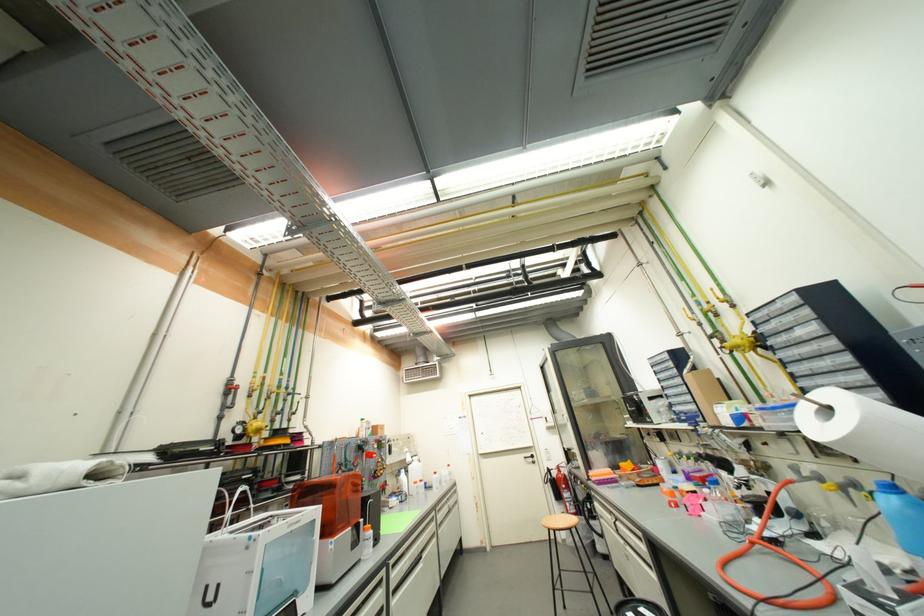
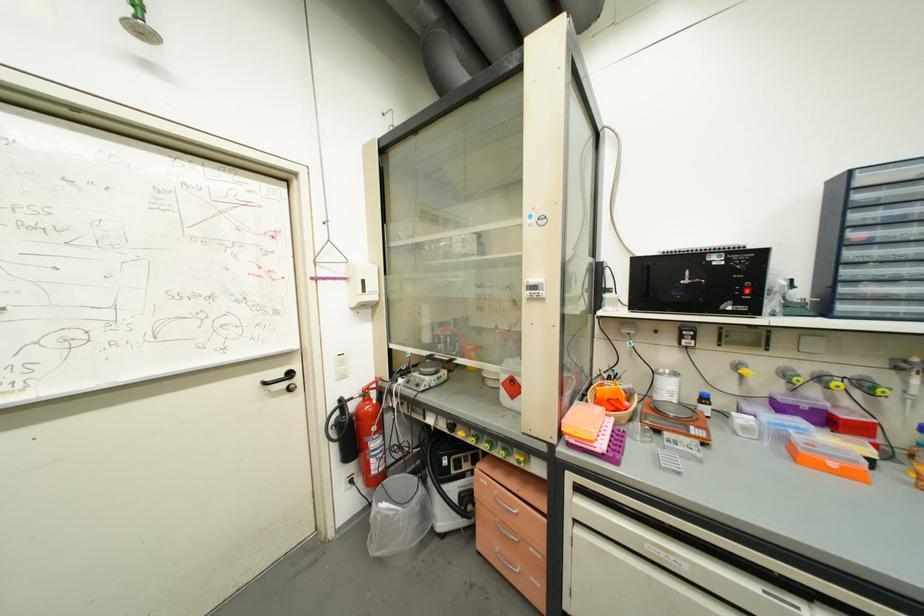
In the second image, find the point that corresponds to the point at 551,419 in the first image.

(369, 283)